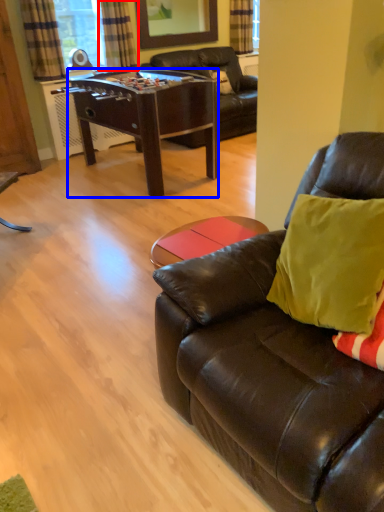
Question: Among these objects, which one is farthest to the camera, curtain (highlighted by a red box) or desk (highlighted by a blue box)?

Choices:
 (A) curtain
 (B) desk

Answer: (A)